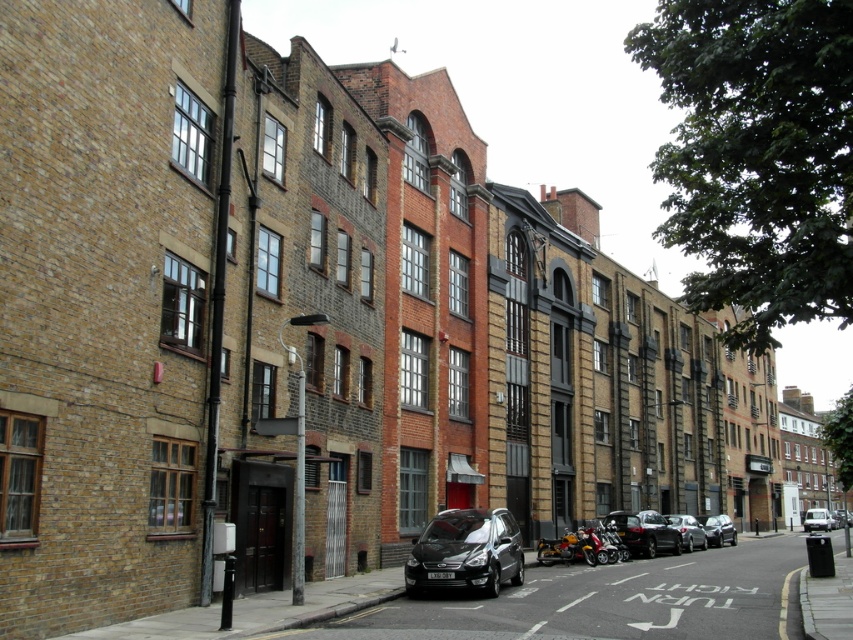
Question: Which object is positioned closest to the black metallic car at center?

Choices:
 (A) shiny black car at center
 (B) silver metallic van at center
 (C) silver metallic car at center

Answer: (A)

Question: Among these objects, which one is nearest to the camera?

Choices:
 (A) black metallic van at center
 (B) shiny chrome motorcycle at center
 (C) shiny black car at center

Answer: (A)

Question: Does black metallic van at center come behind shiny chrome motorcycle at center?

Choices:
 (A) no
 (B) yes

Answer: (A)

Question: Is shiny chrome motorcycle at center below silver metallic van at center?

Choices:
 (A) no
 (B) yes

Answer: (A)

Question: Estimate the real-world distances between objects in this image. Which object is closer to the silver metallic van at center?

Choices:
 (A) black metallic car at center
 (B) shiny black car at center
 (C) black metallic van at center
 (D) silver metallic car at center

Answer: (D)

Question: Is black metallic van at center closer to camera compared to black metallic car at center?

Choices:
 (A) yes
 (B) no

Answer: (A)